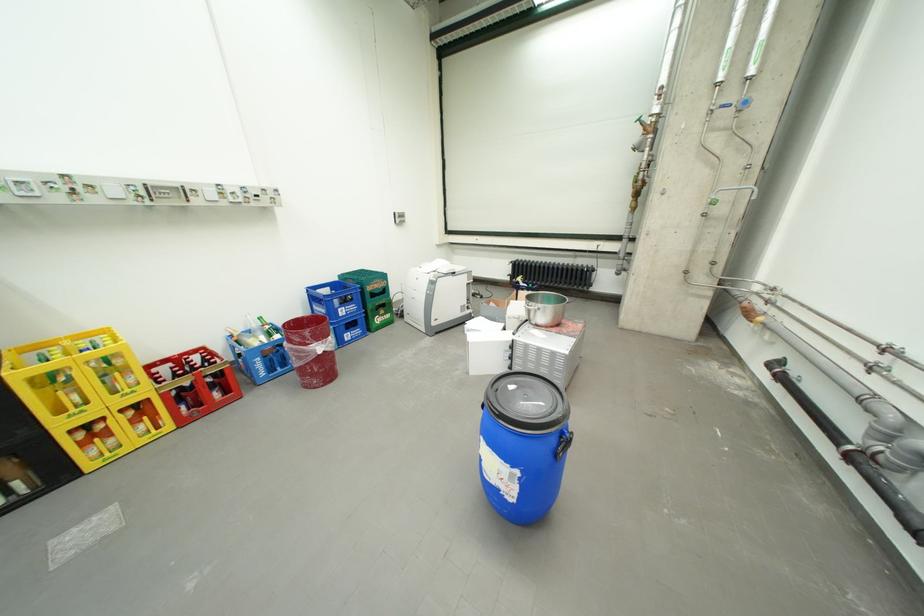
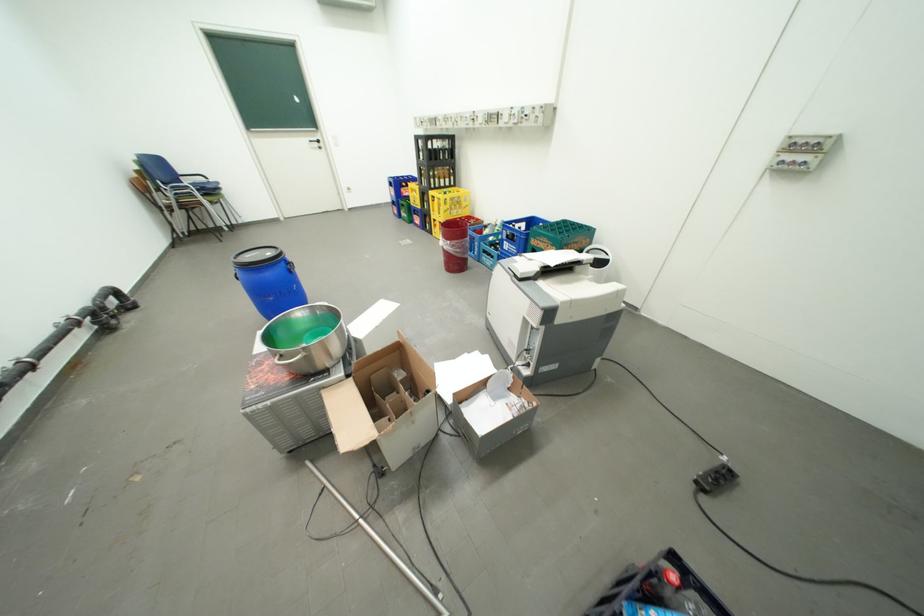
Locate, in the second image, the point that corresponds to pixel 393 282 in the first image.

(562, 246)